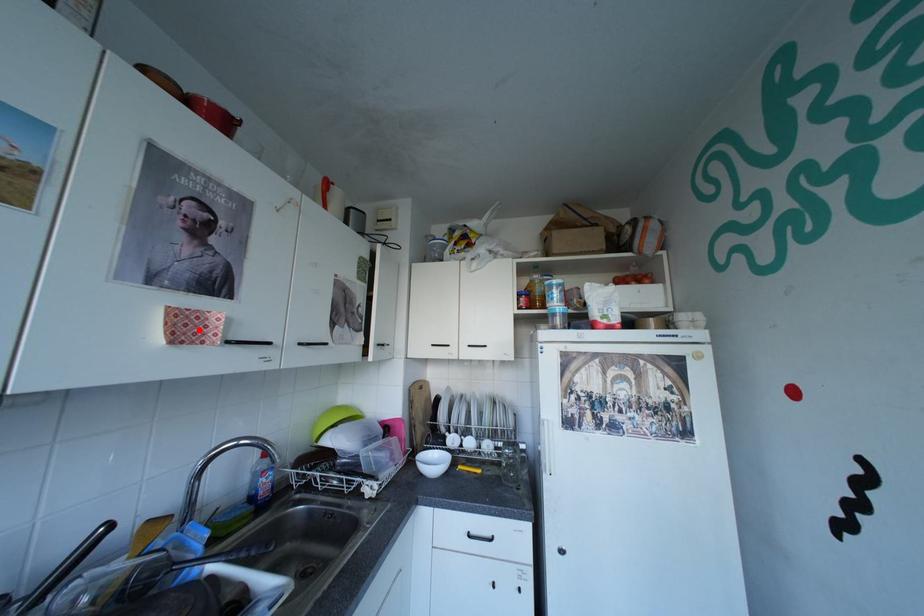
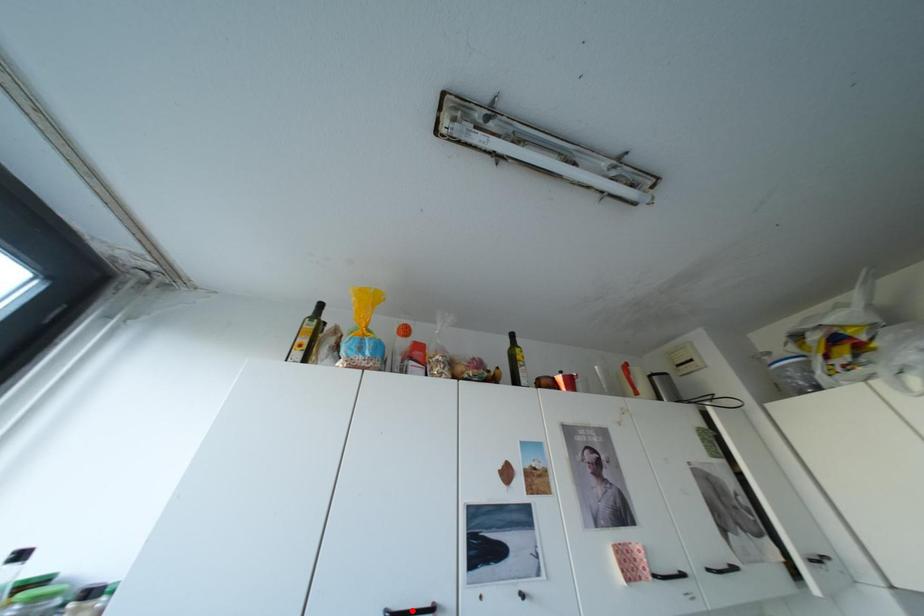
I am providing you with two images of the same scene from different viewpoints. A red point is marked on the first image and another point is marked on the second image. Do the highlighted points in image1 and image2 indicate the same real-world spot?

No